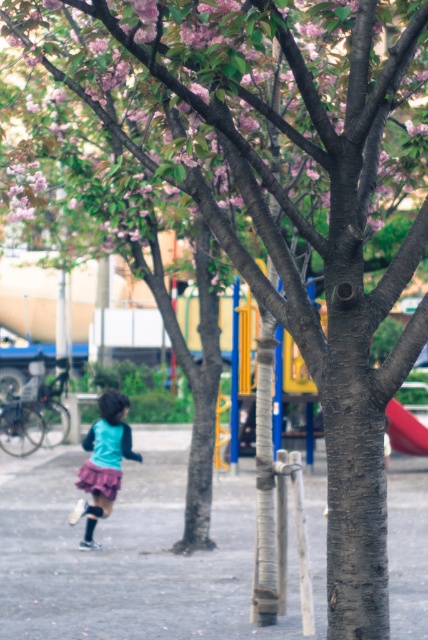
You are standing at the playground and see two points marked in the image. The first point is at coordinates point (398, 33) and the second is at point (395, 404). Which point is closer to you?

Point (398, 33) is in front of point (395, 404), so it is closer to you.

You are standing at the playground and want to take a photo of both point (359,77) and point (118,476) in the image. Since you need to focus on the closer object first, which point should you focus on first?

Point (359,77) is closer to the camera than point (118,476), so you should focus on point (359,77) first.

You are a photographer trying to capture a shot of the pink matte flowers at upper left and the matte teal shirt at center. From your current position, which object is positioned to the right?

The pink matte flowers at upper left are positioned to the right of the matte teal shirt at center.